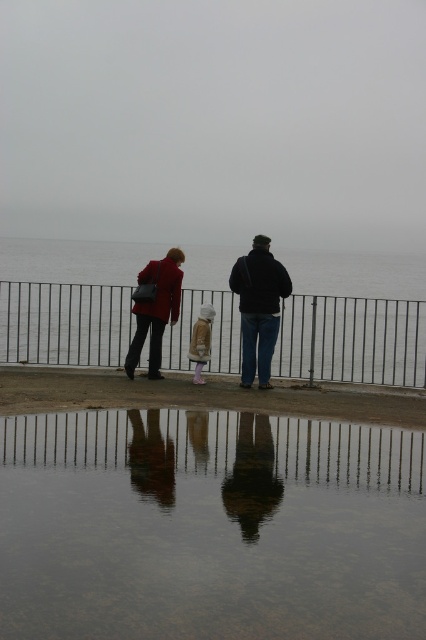
Question: Can you confirm if clear water at center is bigger than smooth concrete surface at center?

Choices:
 (A) no
 (B) yes

Answer: (A)

Question: Can you confirm if clear water at center is thinner than smooth concrete surface at center?

Choices:
 (A) no
 (B) yes

Answer: (B)

Question: Is matte black jacket at center to the left of dark blue jeans at center from the viewer's perspective?

Choices:
 (A) yes
 (B) no

Answer: (B)

Question: Estimate the real-world distances between objects in this image. Which object is closer to the smooth concrete surface at center?

Choices:
 (A) black metal fence at center
 (B) matte black coat at left
 (C) dark blue jeans at center
 (D) matte black jacket at center

Answer: (C)

Question: Which of the following is the farthest from the observer?

Choices:
 (A) (331, 307)
 (B) (276, 292)
 (C) (8, 611)

Answer: (A)

Question: Based on their relative distances, which object is farther from the black metal fence at center?

Choices:
 (A) clear water at center
 (B) matte black jacket at center
 (C) matte black coat at left

Answer: (A)